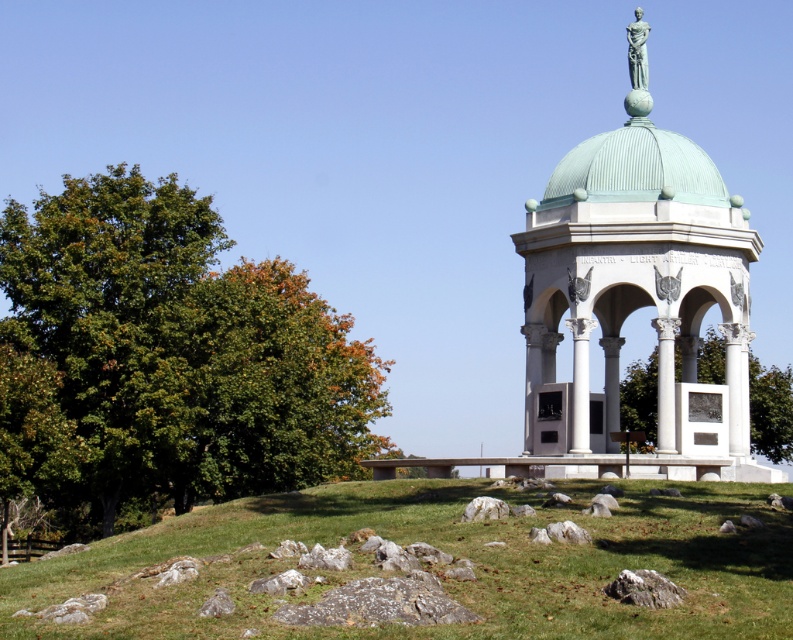
Question: Does green leafy tree at left have a lesser width compared to green marble gazebo at center?

Choices:
 (A) yes
 (B) no

Answer: (B)

Question: Is green leafy tree at left to the left of green marble gazebo at center from the viewer's perspective?

Choices:
 (A) yes
 (B) no

Answer: (A)

Question: Which object is the closest to the green grass at lower center?

Choices:
 (A) green marble gazebo at center
 (B) green leafy tree at left

Answer: (A)

Question: Which object is farther from the camera taking this photo?

Choices:
 (A) green leafy tree at left
 (B) green leafy tree at center
 (C) green grass at lower center

Answer: (B)

Question: Which object is positioned farthest from the green grass at lower center?

Choices:
 (A) green leafy tree at left
 (B) green marble gazebo at center
 (C) green leafy tree at center

Answer: (C)

Question: Where is green leafy tree at left located in relation to green grass at lower center in the image?

Choices:
 (A) below
 (B) above

Answer: (B)